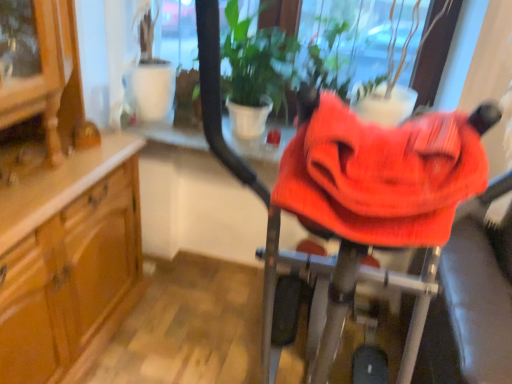
Question: Are knitted fabric baby carriage at center and green leafy plant at center making contact?

Choices:
 (A) yes
 (B) no

Answer: (B)

Question: Considering the relative sizes of knitted fabric baby carriage at center and green leafy plant at center in the image provided, is knitted fabric baby carriage at center thinner than green leafy plant at center?

Choices:
 (A) yes
 (B) no

Answer: (A)

Question: Is knitted fabric baby carriage at center to the right of green leafy plant at center from the viewer's perspective?

Choices:
 (A) no
 (B) yes

Answer: (B)

Question: Is the position of knitted fabric baby carriage at center more distant than that of green leafy plant at center?

Choices:
 (A) yes
 (B) no

Answer: (B)

Question: Is there a large distance between knitted fabric baby carriage at center and green leafy plant at center?

Choices:
 (A) yes
 (B) no

Answer: (B)

Question: Is knitted fabric baby carriage at center at the left side of green leafy plant at center?

Choices:
 (A) yes
 (B) no

Answer: (B)

Question: From a real-world perspective, does green leafy plant at center sit lower than knitted fabric baby carriage at center?

Choices:
 (A) yes
 (B) no

Answer: (A)

Question: Does green leafy plant at center lie in front of knitted fabric baby carriage at center?

Choices:
 (A) no
 (B) yes

Answer: (A)

Question: Is green leafy plant at center oriented away from knitted fabric baby carriage at center?

Choices:
 (A) yes
 (B) no

Answer: (B)

Question: Is green leafy plant at center in contact with knitted fabric baby carriage at center?

Choices:
 (A) no
 (B) yes

Answer: (A)

Question: Does green leafy plant at center have a larger size compared to knitted fabric baby carriage at center?

Choices:
 (A) yes
 (B) no

Answer: (A)

Question: Can you confirm if green leafy plant at center is positioned to the right of knitted fabric baby carriage at center?

Choices:
 (A) yes
 (B) no

Answer: (B)

Question: Is knitted fabric baby carriage at center wider or thinner than green leafy plant at center?

Choices:
 (A) thin
 (B) wide

Answer: (A)